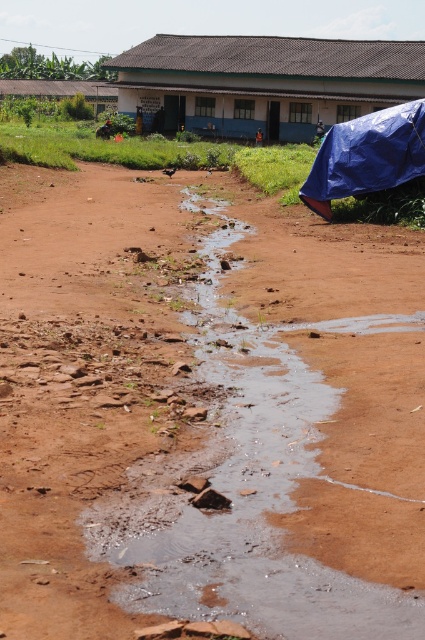
You are standing on the dirt road observing the blue corrugated metal hut at upper center and the brown corrugated metal hut at upper center. Which one appears nearer to you?

The blue corrugated metal hut at upper center appears nearer to you because it is closer to the viewer than the brown corrugated metal hut at upper center.